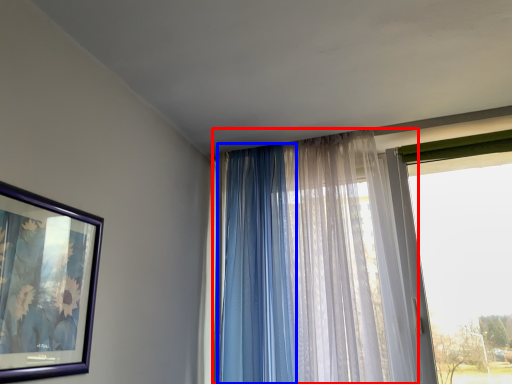
Question: Which object is closer to the camera taking this photo, curtain (highlighted by a red box) or curtain (highlighted by a blue box)?

Choices:
 (A) curtain
 (B) curtain

Answer: (A)